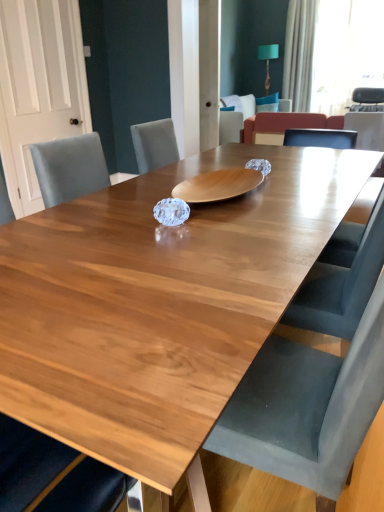
The height and width of the screenshot is (512, 384). Identify the location of white fabric curtain at upper right. coord(299,53).

Find the location of a particular element. This screenshot has height=512, width=384. velvet armchair at upper right, placed as the 2th armchair when sorted from left to right is located at coordinates (367, 100).

This screenshot has height=512, width=384. Describe the element at coordinates (159, 304) in the screenshot. I see `wooden table at center` at that location.

The image size is (384, 512). In order to click on white sheer curtain at upper right in this screenshot , I will do `click(346, 52)`.

Is white fabric curtain at upper right touching wooden table at center?

white fabric curtain at upper right and wooden table at center are clearly separated.

Considering the relative sizes of white fabric curtain at upper right and wooden table at center in the image provided, is white fabric curtain at upper right bigger than wooden table at center?

Indeed, white fabric curtain at upper right has a larger size compared to wooden table at center.

From the image's perspective, who appears lower, white fabric curtain at upper right or wooden table at center?

wooden table at center.

Who is more distant, white fabric curtain at upper right or wooden table at center?

white fabric curtain at upper right is behind.

Between velvet armchair at upper right, acting as the 1th armchair starting from the right, and wooden table at center, which one has less height?

velvet armchair at upper right, acting as the 1th armchair starting from the right, is shorter.

Is velvet armchair at upper right, placed as the 2th armchair when sorted from left to right, smaller than wooden table at center?

No.

Is velvet armchair at upper right, acting as the 1th armchair starting from the right, looking in the opposite direction of wooden table at center?

No, velvet armchair at upper right, acting as the 1th armchair starting from the right,'s orientation is not away from wooden table at center.

Based on the photo, is velvet armchair at upper right, placed as the 2th armchair when sorted from left to right, wider or thinner than wooden table at center?

Considering their sizes, velvet armchair at upper right, placed as the 2th armchair when sorted from left to right, looks broader than wooden table at center.

Considering the points (250, 109) and (99, 259), which point is in front, point (250, 109) or point (99, 259)?

The point (99, 259) is closer to the camera.

From the image's perspective, which one is positioned higher, velvet armchair at center, the 1th armchair from the left, or wooden table at center?

From the image's view, velvet armchair at center, the 1th armchair from the left, is above.

Considering their positions, is velvet armchair at center, the second armchair viewed from the right, located in front of or behind wooden table at center?

velvet armchair at center, the second armchair viewed from the right, is behind wooden table at center.

Who is smaller, velvet armchair at center, the 1th armchair from the left, or wooden table at center?

wooden table at center is smaller.

Is white fabric curtain at upper right next to velvet armchair at center, the 1th armchair from the left, and touching it?

No, white fabric curtain at upper right is not next to velvet armchair at center, the 1th armchair from the left.

Which is less distant, [300,59] or [250,100]?

Point [300,59] is positioned farther from the camera compared to point [250,100].

From the image's perspective, which is below, white fabric curtain at upper right or velvet armchair at center, the second armchair viewed from the right?

velvet armchair at center, the second armchair viewed from the right, is shown below in the image.

Is point (331, 61) closer to viewer compared to point (167, 343)?

No, it is not.

In the scene shown: Is white sheer curtain at upper right placed right next to wooden table at center?

There is a gap between white sheer curtain at upper right and wooden table at center.

Is wooden table at center at the back of white sheer curtain at upper right?

white sheer curtain at upper right is not turned away from wooden table at center.

From the image's perspective, is white sheer curtain at upper right beneath wooden table at center?

No.

Is point (315, 201) farther from viewer compared to point (383, 89)?

No.

Considering the relative sizes of wooden table at center and velvet armchair at upper right, placed as the 2th armchair when sorted from left to right, in the image provided, is wooden table at center taller than velvet armchair at upper right, placed as the 2th armchair when sorted from left to right,?

Indeed, wooden table at center has a greater height compared to velvet armchair at upper right, placed as the 2th armchair when sorted from left to right.

Is wooden table at center wider than velvet armchair at upper right, placed as the 2th armchair when sorted from left to right?

No.

Based on the photo, does wooden table at center appear on the left side of velvet armchair at upper right, acting as the 1th armchair starting from the right?

Yes.

Which is in front, point (376, 106) or point (304, 42)?

Point (376, 106)

Which object is closer to the camera taking this photo, velvet armchair at upper right, acting as the 1th armchair starting from the right, or white fabric curtain at upper right?

Positioned in front is white fabric curtain at upper right.

Which is more to the right, velvet armchair at upper right, acting as the 1th armchair starting from the right, or white fabric curtain at upper right?

velvet armchair at upper right, acting as the 1th armchair starting from the right, is more to the right.

Can white fabric curtain at upper right be found inside velvet armchair at upper right, acting as the 1th armchair starting from the right?

No.

Locate an element on the screen. The image size is (384, 512). curtain above the wooden table at center (from the image's perspective) is located at coordinates (299, 53).

Image resolution: width=384 pixels, height=512 pixels. In order to click on table located in front of the velvet armchair at upper right, acting as the 1th armchair starting from the right in this screenshot , I will do `click(159, 304)`.

Which object lies further to the anchor point wooden table at center, velvet armchair at center, the second armchair viewed from the right, or white fabric curtain at upper right?

white fabric curtain at upper right is positioned further to the anchor wooden table at center.

Which object lies further to the anchor point velvet armchair at center, the second armchair viewed from the right, white fabric curtain at upper right or white sheer curtain at upper right?

The object further to velvet armchair at center, the second armchair viewed from the right, is white sheer curtain at upper right.

Based on their spatial positions, is wooden table at center or velvet armchair at upper right, placed as the 2th armchair when sorted from left to right, further from white fabric curtain at upper right?

wooden table at center is further to white fabric curtain at upper right.

Considering their positions, is velvet armchair at center, the 1th armchair from the left, positioned closer to white sheer curtain at upper right than velvet armchair at upper right, placed as the 2th armchair when sorted from left to right?

velvet armchair at upper right, placed as the 2th armchair when sorted from left to right.

Looking at the image, which one is located closer to white fabric curtain at upper right, wooden table at center or velvet armchair at center, the second armchair viewed from the right?

velvet armchair at center, the second armchair viewed from the right, lies closer to white fabric curtain at upper right than the other object.

Estimate the real-world distances between objects in this image. Which object is further from white sheer curtain at upper right, velvet armchair at upper right, placed as the 2th armchair when sorted from left to right, or white fabric curtain at upper right?

Among the two, velvet armchair at upper right, placed as the 2th armchair when sorted from left to right, is located further to white sheer curtain at upper right.

Looking at the image, which one is located further to wooden table at center, white fabric curtain at upper right or velvet armchair at upper right, acting as the 1th armchair starting from the right?

white fabric curtain at upper right.

Based on their spatial positions, is velvet armchair at center, the second armchair viewed from the right, or white sheer curtain at upper right further from velvet armchair at upper right, placed as the 2th armchair when sorted from left to right?

velvet armchair at center, the second armchair viewed from the right, is positioned further to the anchor velvet armchair at upper right, placed as the 2th armchair when sorted from left to right.

What are the coordinates of `window screen between white fabric curtain at upper right and velvet armchair at upper right, acting as the 1th armchair starting from the right, in the horizontal direction` in the screenshot? It's located at (346, 52).

I want to click on curtain between wooden table at center and velvet armchair at upper right, acting as the 1th armchair starting from the right, from front to back, so click(299, 53).

Where is `curtain between velvet armchair at center, the 1th armchair from the left, and velvet armchair at upper right, placed as the 2th armchair when sorted from left to right, from left to right`? The image size is (384, 512). curtain between velvet armchair at center, the 1th armchair from the left, and velvet armchair at upper right, placed as the 2th armchair when sorted from left to right, from left to right is located at coordinates (299, 53).

Find the location of a particular element. The image size is (384, 512). window screen between velvet armchair at center, the second armchair viewed from the right, and velvet armchair at upper right, placed as the 2th armchair when sorted from left to right, from left to right is located at coordinates (346, 52).